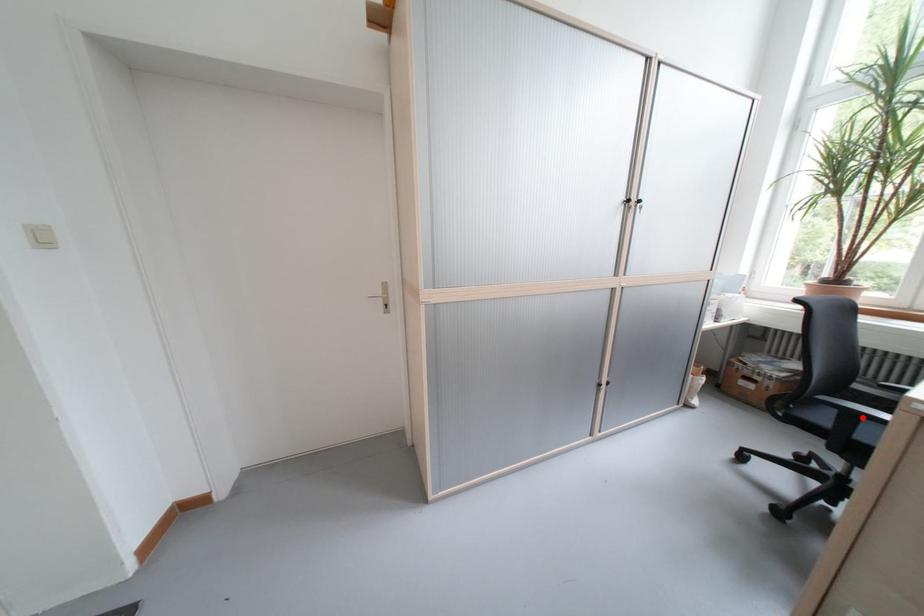
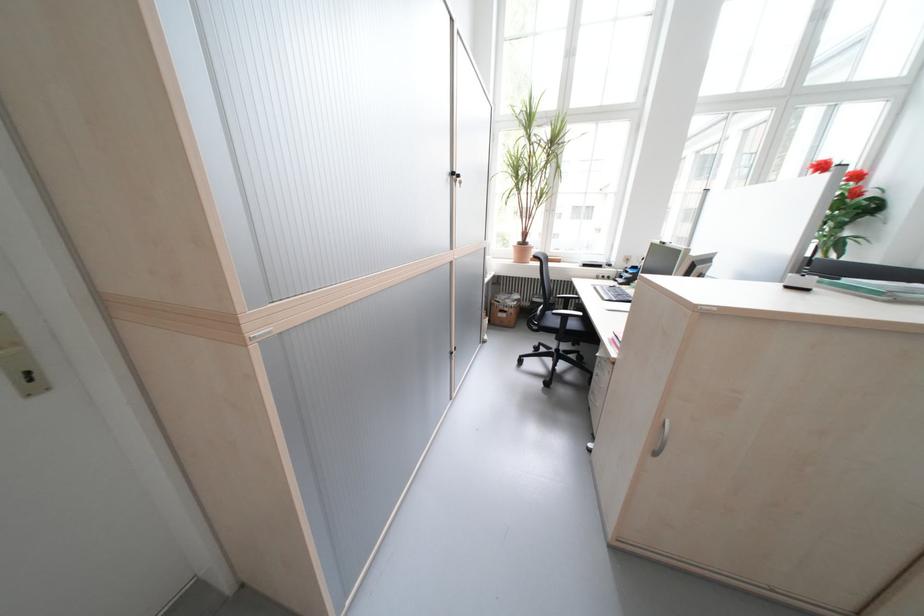
Where in the second image is the point corresponding to the highlighted location from the first image?

(575, 318)